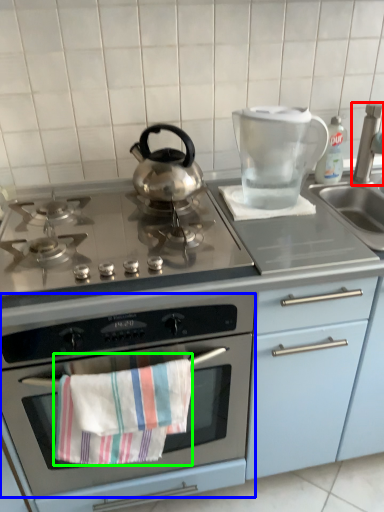
Question: Considering the real-world distances, which object is closest to faucet (highlighted by a red box)? oven (highlighted by a blue box) or beach towel (highlighted by a green box).

Choices:
 (A) oven
 (B) beach towel

Answer: (A)